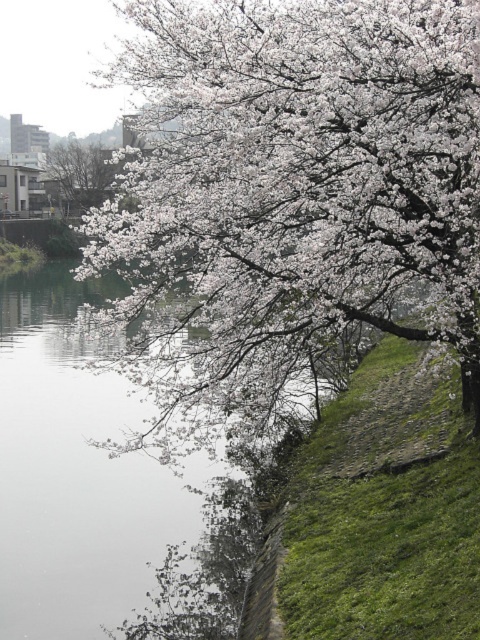
Based on the photo, you are a photographer standing at the riverside and want to capture a closeup shot of the white matte blossoms at upper center. If your camera has a maximum focus range of 7 meters, will you be able to focus on the blossoms without moving closer?

The distance between the white matte blossoms at upper center and the camera is 7.13 meters, which exceeds the camera maximum focus range of 7 meters. Therefore, you won not be able to focus on the blossoms without moving closer.

Consider the image. You are standing at the riverside and see two points in the image. Which point is closer to you, point (465, 68) or point (84, 148)?

Point (465, 68) is closer to the viewer than point (84, 148).